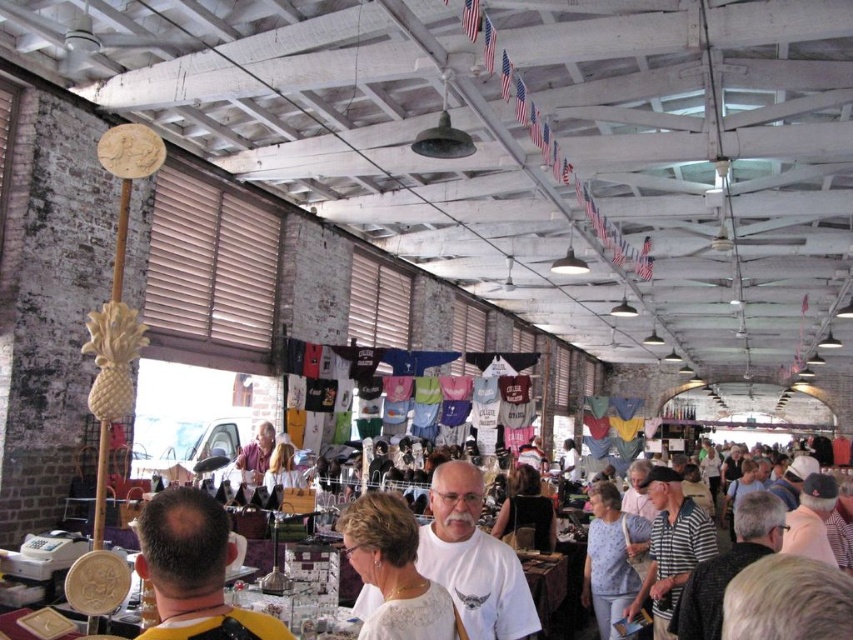
Consider the image. You are a customer at the flea market and want to inspect the dark brown leather jacket at center. If you are standing 2 meters away from it, can you reach it without moving closer?

The dark brown leather jacket at center is 2.31 meters away from the camera, so you are currently 0.31 meters away from it. Since you are already within reach, you can inspect it without moving closer.